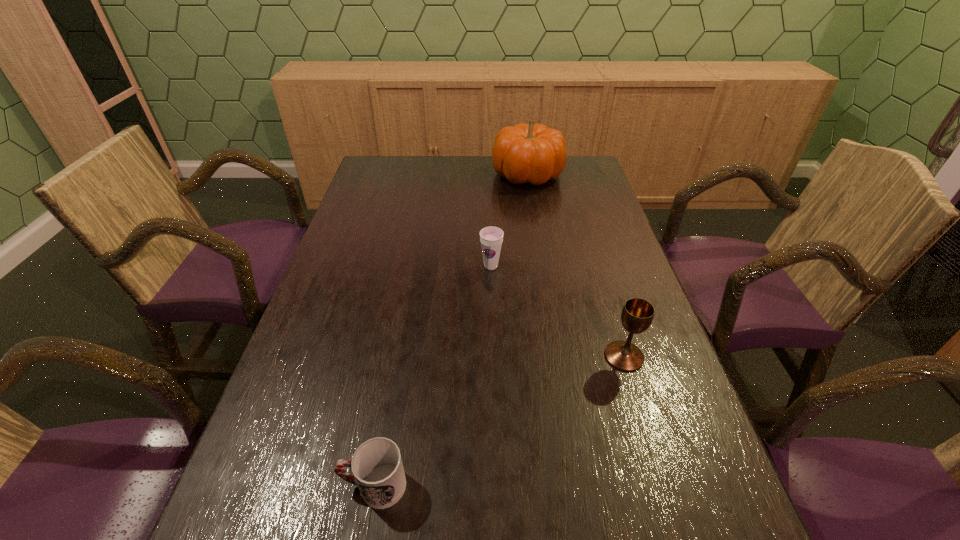
Locate an element on the screen. The image size is (960, 540). pumpkin is located at coordinates (534, 153).

I want to click on the tallest object, so click(x=534, y=153).

You are a GUI agent. You are given a task and a screenshot of the screen. Output one action in this format:
    pyautogui.click(x=<x>, y=<y>)
    Task: Click on the third farthest object
    The height and width of the screenshot is (540, 960).
    Given the screenshot: What is the action you would take?
    pyautogui.click(x=637, y=314)

Locate an element on the screen. chalice is located at coordinates (637, 314).

Image resolution: width=960 pixels, height=540 pixels. What are the coordinates of `the right cup` in the screenshot? It's located at (491, 238).

Locate an element on the screen. The image size is (960, 540). the second farthest object is located at coordinates (491, 238).

Locate an element on the screen. This screenshot has height=540, width=960. the leftmost object is located at coordinates (377, 466).

Find the location of `the left cup`. the left cup is located at coordinates (377, 466).

This screenshot has height=540, width=960. Identify the location of vacant space located 0.060m on the front of the farthest object. (532, 202).

Image resolution: width=960 pixels, height=540 pixels. In order to click on blank area located on the left of the second nearest object in this screenshot , I will do `click(429, 356)`.